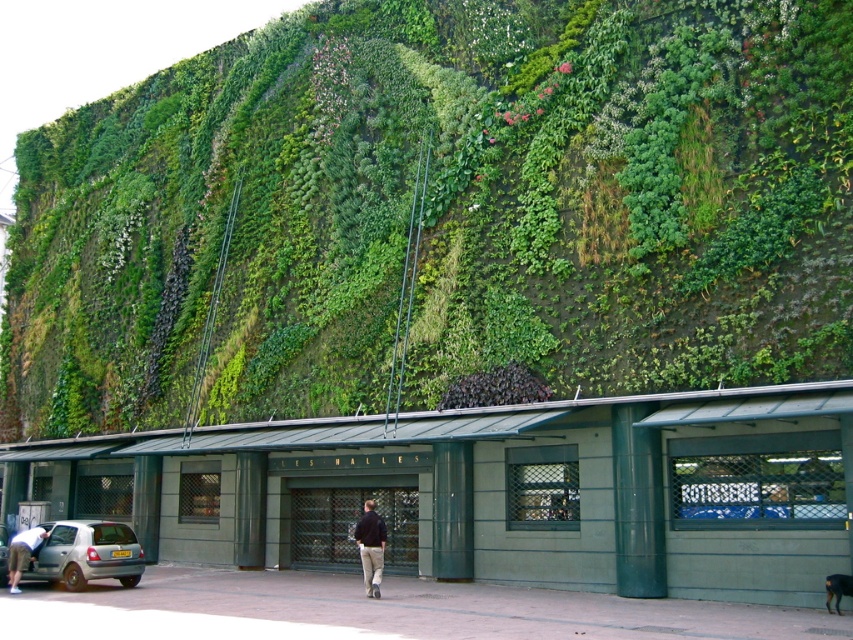
You are a delivery person needing to park your 5.2 meter long silver metallic car at lower left close to the green leafy wall at upper center. Can you park it within 13 meters of the wall?

The distance between the green leafy wall at upper center and the silver metallic car at lower left is 12.95 meters, which is within the 13 meter limit. Therefore, the car can be parked within the desired distance.

You are a delivery person trying to park your silver metallic car at lower left near the entrance of the building. However, there is a green leafy wall at upper center blocking the path. Can you drive under it safely?

The green leafy wall at upper center is located above the silver metallic car at lower left, so the car can drive under it safely as the wall is positioned above and not obstructing the path.